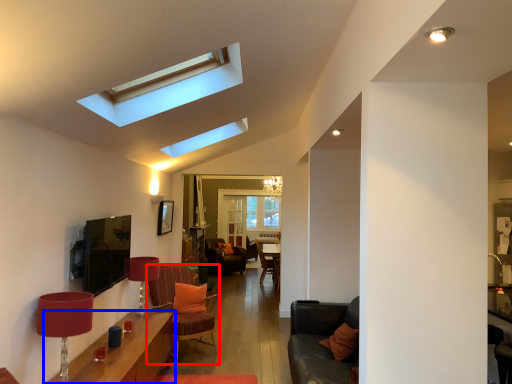
Question: Which object appears closest to the camera in this image, chair (highlighted by a red box) or table (highlighted by a blue box)?

Choices:
 (A) chair
 (B) table

Answer: (B)